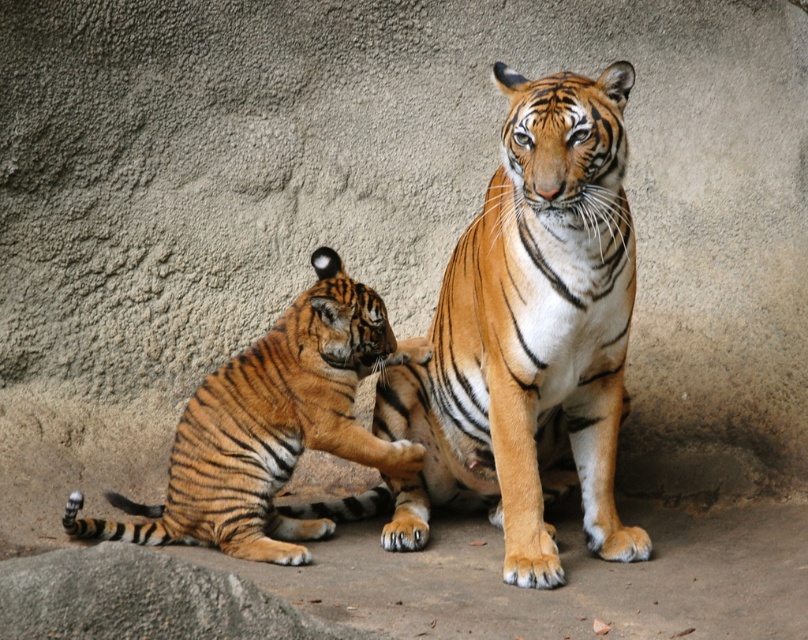
Can you confirm if orange striped tiger at center is wider than orange striped tiger at lower left?

No.

Does point (381, 381) come in front of point (339, 509)?

Yes, it is.

The image size is (808, 640). What do you see at coordinates (529, 336) in the screenshot? I see `orange striped tiger at center` at bounding box center [529, 336].

Where is `orange striped tiger at center`? Image resolution: width=808 pixels, height=640 pixels. orange striped tiger at center is located at coordinates (529, 336).